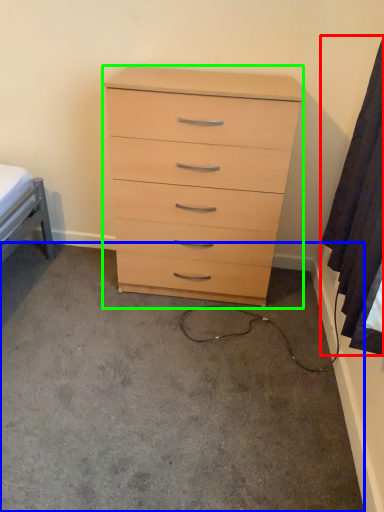
Question: Estimate the real-world distances between objects in this image. Which object is farther from curtain (highlighted by a red box), concrete (highlighted by a blue box) or chest of drawers (highlighted by a green box)?

Choices:
 (A) concrete
 (B) chest of drawers

Answer: (A)